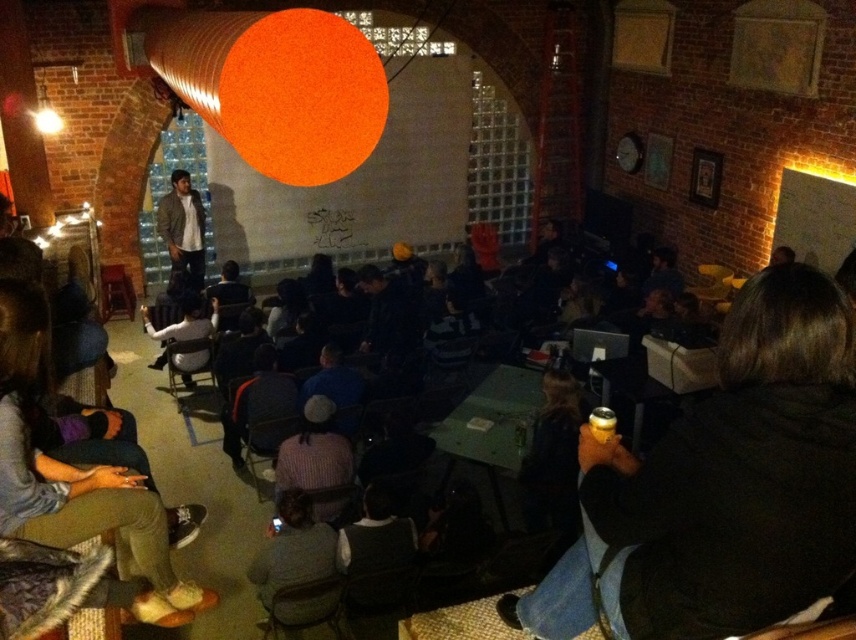
You are sitting in the lecture hall and want to retrieve your jacket from the stage area. Which jacket is closer to you when you look at the denim jacket at lower left and the light brown leather jacket at center?

The denim jacket at lower left is closer to you because it is positioned under the light brown leather jacket at center, meaning it is lower in the stage area and thus nearer to your seated position.

From the picture: You are organizing a coat check for an event and need to determine which jacket takes up more space. Based on the image, which jacket between the black matte jacket at lower right and the light brown leather jacket at center requires more storage space?

The light brown leather jacket at center requires more storage space because it is larger than the black matte jacket at lower right.

You are attending a lecture in this venue and need to sit between the black matte jacket at lower right and the denim jacket at lower left. Can you comfortably sit between them if you require at least 50 cm of space?

The black matte jacket at lower right has a lesser width compared to denim jacket at lower left, but the exact distance between them isn not specified. Without knowing the distance between the two jackets, it is impossible to determine if there is enough space for you to sit comfortably with at least 50 cm of space.